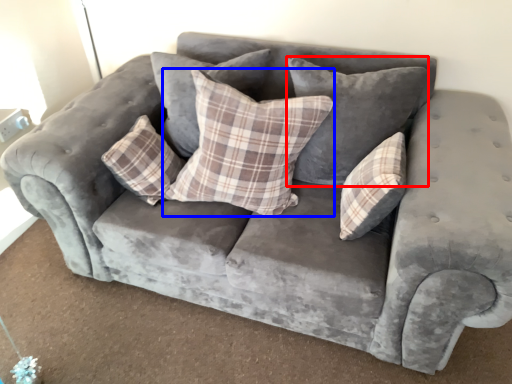
Question: Among these objects, which one is nearest to the camera, pillow (highlighted by a red box) or pillow (highlighted by a blue box)?

Choices:
 (A) pillow
 (B) pillow

Answer: (B)